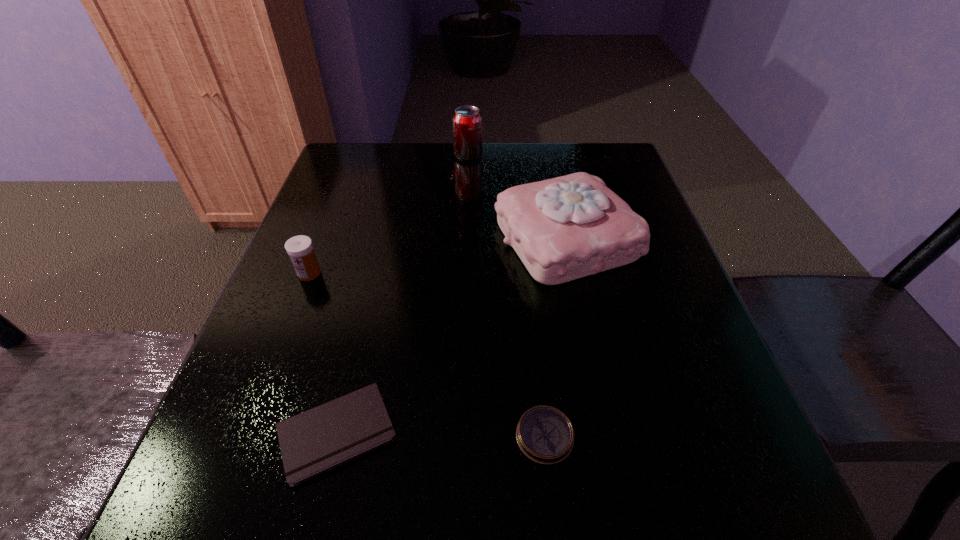
The image size is (960, 540). Find the location of `free space between the checkbook and the compass`. free space between the checkbook and the compass is located at coordinates (441, 434).

Locate an element on the screen. The height and width of the screenshot is (540, 960). blank region between the leftmost object and the farthest object is located at coordinates (389, 214).

You are a GUI agent. You are given a task and a screenshot of the screen. Output one action in this format:
    pyautogui.click(x=<x>, y=<y>)
    Task: Click on the vacant space in between the compass and the farthest object
    The height and width of the screenshot is (540, 960).
    Given the screenshot: What is the action you would take?
    pyautogui.click(x=506, y=296)

Locate an element on the screen. empty space that is in between the compass and the checkbook is located at coordinates (441, 434).

Where is `free space between the second object from left to right and the farthest object`? This screenshot has height=540, width=960. free space between the second object from left to right and the farthest object is located at coordinates (402, 294).

Identify which object is the fourth closest to the medicine. Please provide its 2D coordinates. Your answer should be formatted as a tuple, i.e. [(x, y)], where the tuple contains the x and y coordinates of a point satisfying the conditions above.

[(467, 120)]

Find the location of a particular element. object that stands as the closest to the cake is located at coordinates (467, 120).

This screenshot has width=960, height=540. Identify the location of vacant point that satisfies the following two spatial constraints: 1. on the back side of the compass; 2. on the right side of the cake. pos(523,239).